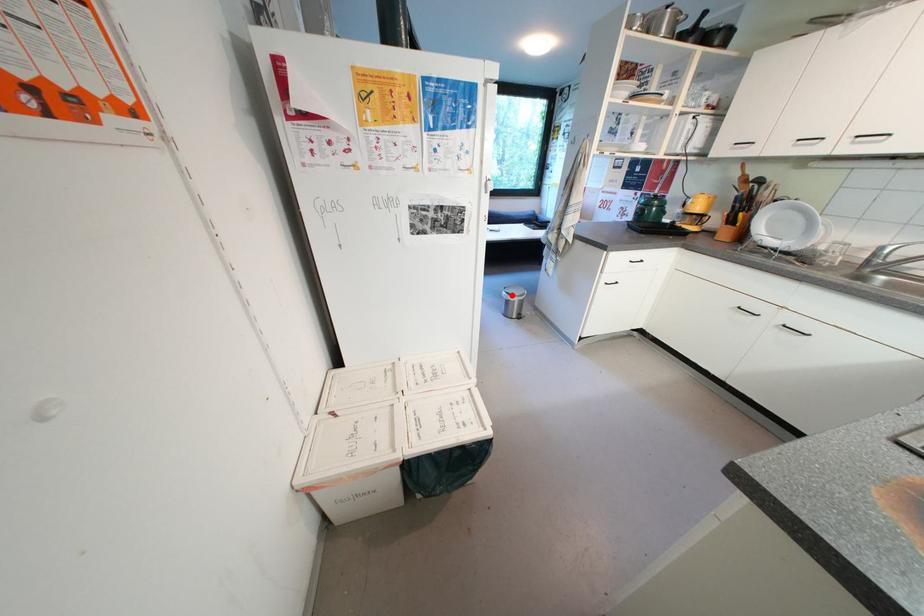
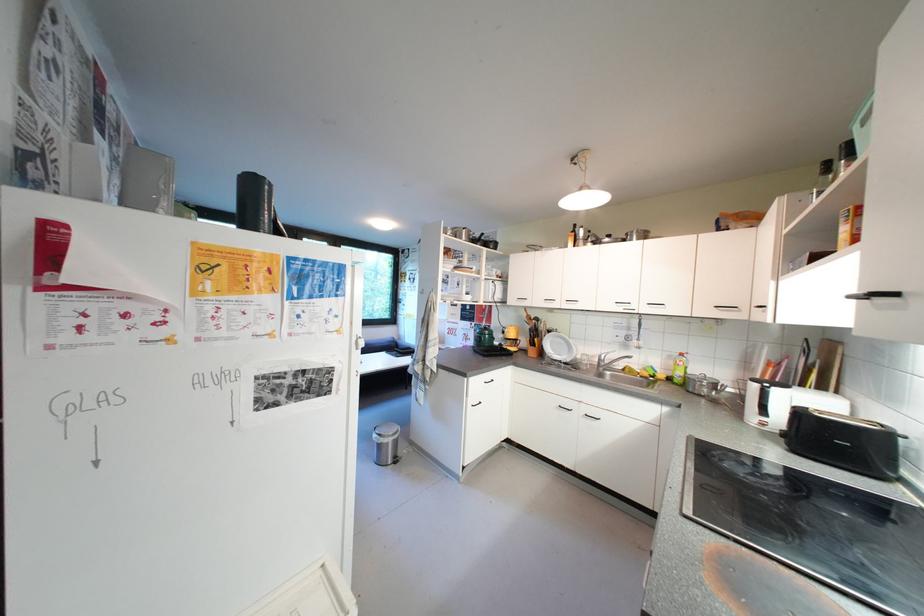
Question: I am providing you with two images of the same scene from different viewpoints. Image1 has a red point marked. In image2, the corresponding 3D location appears at what relative position? Reply with the corresponding letter.

Choices:
 (A) Closer
 (B) Farther

Answer: (A)